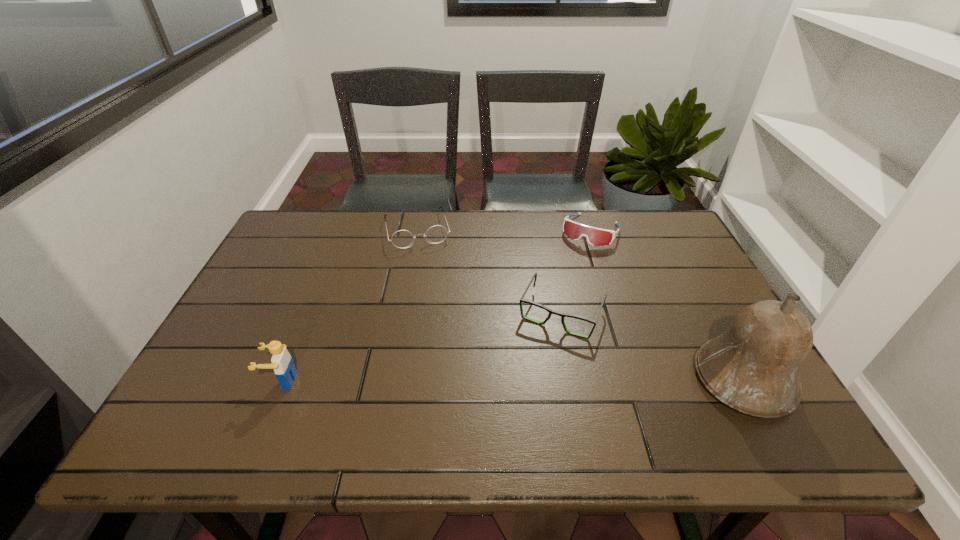
At what (x,y) coordinates should I click in order to perform the action: click on vacant region located 0.140m on the front-facing side of the farther spectacles. Please return your answer as a coordinate pair (x, y). Image resolution: width=960 pixels, height=540 pixels. Looking at the image, I should click on (429, 279).

Where is `vacant point located 0.240m on the front-facing side of the farther spectacles`? vacant point located 0.240m on the front-facing side of the farther spectacles is located at coordinates (435, 303).

Where is `goggles that is positioned at the far edge`? goggles that is positioned at the far edge is located at coordinates (595, 236).

Find the location of `spectacles that is at the far edge`. spectacles that is at the far edge is located at coordinates (401, 239).

Where is `Lego that is positioned at the near edge`? The height and width of the screenshot is (540, 960). Lego that is positioned at the near edge is located at coordinates (282, 363).

Locate an element on the screen. The width and height of the screenshot is (960, 540). bell situated at the near edge is located at coordinates (754, 367).

Where is `object situated at the right edge`? The image size is (960, 540). object situated at the right edge is located at coordinates (754, 367).

Find the location of a particular element. The width and height of the screenshot is (960, 540). object present at the near right corner is located at coordinates (754, 367).

I want to click on free space at the far edge of the desktop, so click(x=560, y=214).

This screenshot has width=960, height=540. Find the location of `vacant space at the near edge of the desktop`. vacant space at the near edge of the desktop is located at coordinates (382, 386).